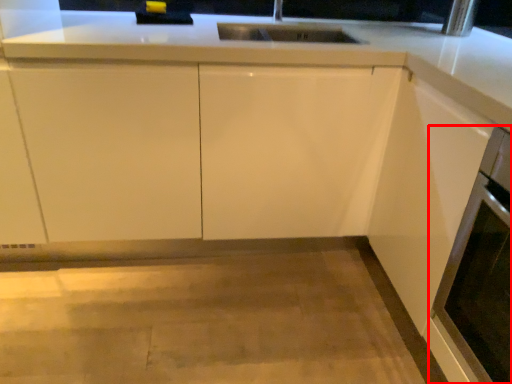
Question: Observing the image, what is the correct spatial positioning of oven (annotated by the red box) in reference to cabinetry?

Choices:
 (A) right
 (B) left

Answer: (A)